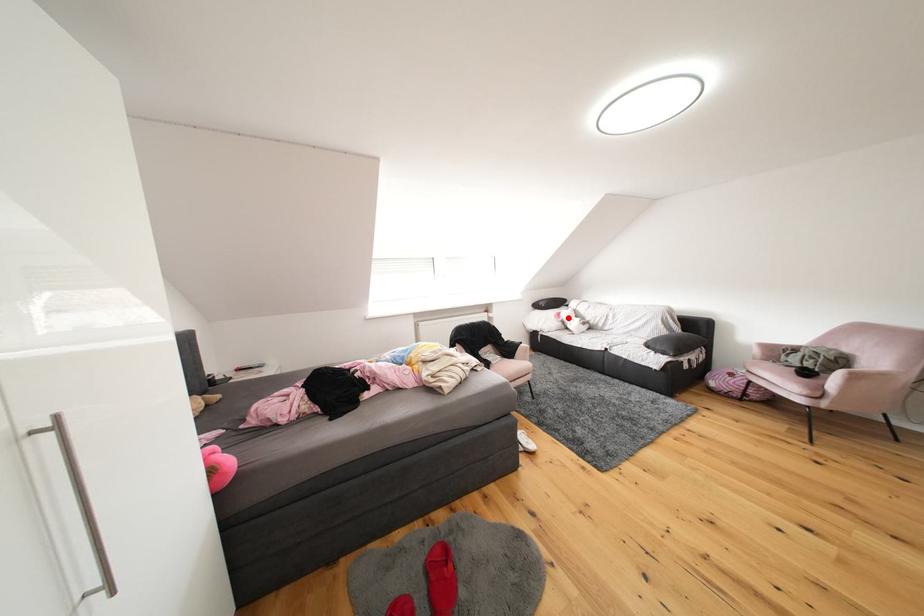
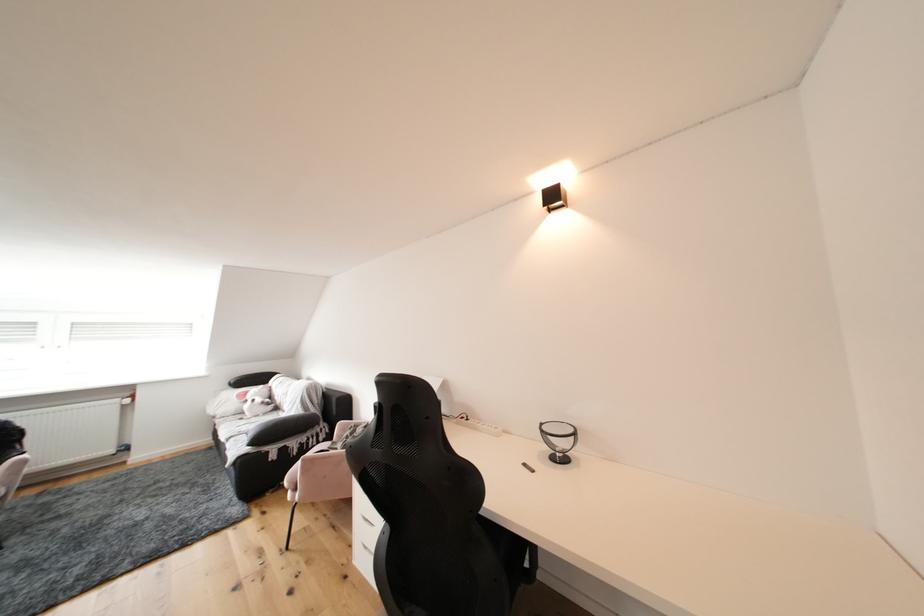
The point at the highlighted location is marked in the first image. Where is the corresponding point in the second image?

(256, 397)